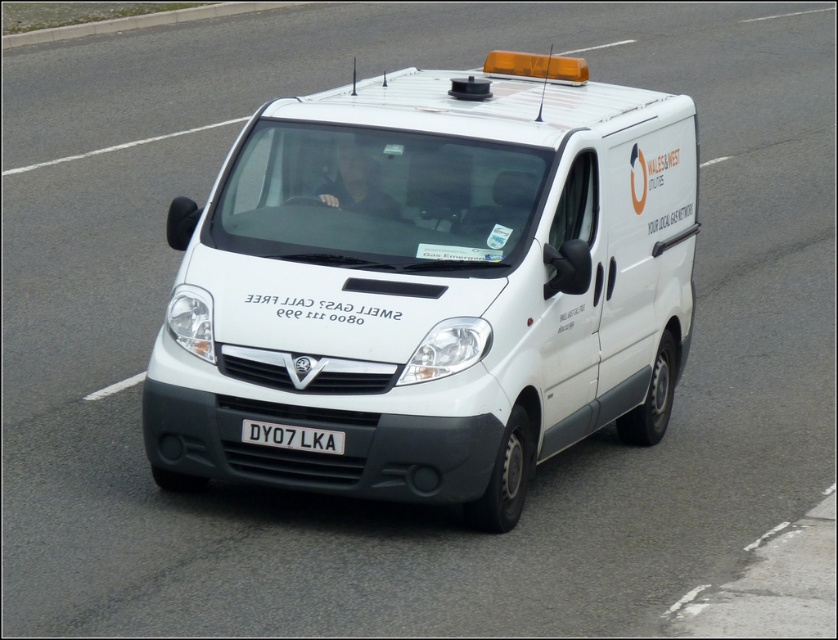
Question: Observing the image, what is the correct spatial positioning of white matte van at center in reference to white plastic license plate at center?

Choices:
 (A) right
 (B) left

Answer: (A)

Question: Does white matte van at center appear on the left side of white plastic license plate at center?

Choices:
 (A) no
 (B) yes

Answer: (A)

Question: Is white matte van at center thinner than white plastic license plate at center?

Choices:
 (A) no
 (B) yes

Answer: (A)

Question: Which of the following is the farthest from the observer?

Choices:
 (A) white plastic license plate at center
 (B) white matte van at center

Answer: (A)